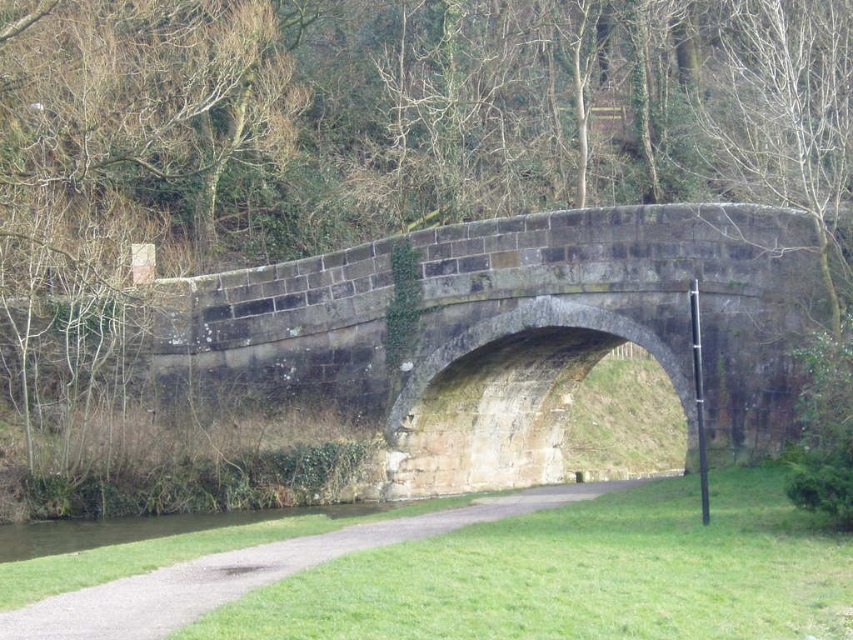
Question: Which of the following is the closest to the observer?

Choices:
 (A) (722, 388)
 (B) (170, 611)
 (C) (253, 518)

Answer: (B)

Question: Is dark gray stone bridge at center smaller than gravel path at center?

Choices:
 (A) no
 (B) yes

Answer: (A)

Question: Is dark gray stone bridge at center smaller than gravel path at center?

Choices:
 (A) yes
 (B) no

Answer: (B)

Question: Can you confirm if dark gray stone bridge at center is thinner than green grassy water at lower left?

Choices:
 (A) yes
 (B) no

Answer: (B)

Question: Which of these objects is positioned farthest from the gravel path at center?

Choices:
 (A) dark gray stone bridge at center
 (B) green grassy water at lower left

Answer: (B)

Question: Considering the real-world distances, which object is farthest from the green grassy water at lower left?

Choices:
 (A) dark gray stone bridge at center
 (B) gravel path at center

Answer: (B)